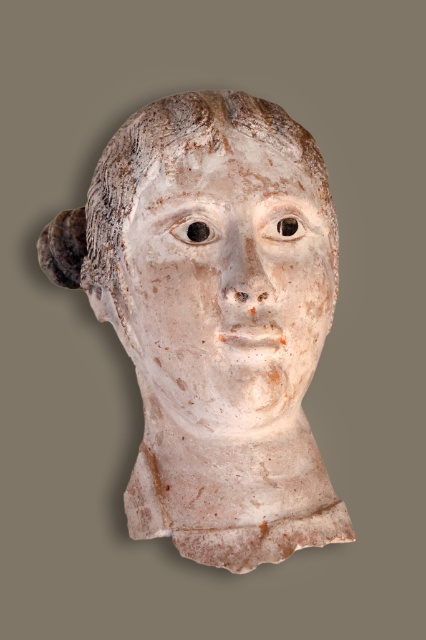
The width and height of the screenshot is (426, 640). I want to click on white marble bust at center, so [x=215, y=320].

Does white marble bust at center appear on the left side of white clay face at center?

Yes, white marble bust at center is to the left of white clay face at center.

Locate an element on the screen. white marble bust at center is located at coordinates (215, 320).